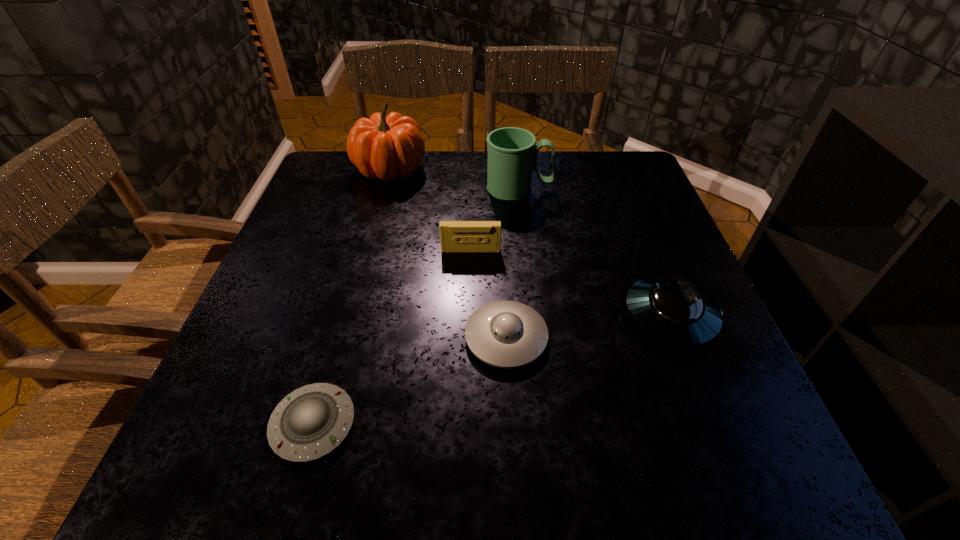
Locate an element on the screen. The height and width of the screenshot is (540, 960). the tallest object is located at coordinates (382, 147).

Locate an element on the screen. Image resolution: width=960 pixels, height=540 pixels. mug is located at coordinates (512, 154).

Where is `videotape`? The image size is (960, 540). videotape is located at coordinates (456, 236).

Locate an element on the screen. the third tallest object is located at coordinates (456, 236).

Locate an element on the screen. The width and height of the screenshot is (960, 540). the tallest saucer is located at coordinates (673, 309).

At what (x,y) coordinates should I click in order to perform the action: click on the rightmost saucer. Please return your answer as a coordinate pair (x, y). The image size is (960, 540). Looking at the image, I should click on (673, 309).

Locate an element on the screen. the second shortest object is located at coordinates (506, 334).

Find the location of `the second tallest saucer`. the second tallest saucer is located at coordinates (506, 334).

What are the coordinates of `the leftmost saucer` in the screenshot? It's located at (310, 422).

Identify the location of the nearest object. (310, 422).